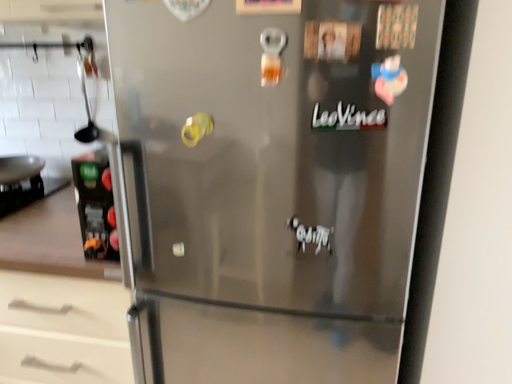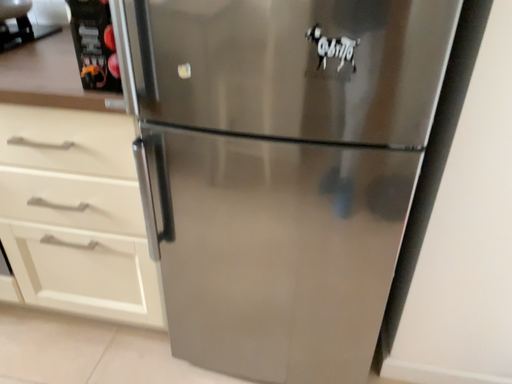
Question: How did the camera likely rotate when shooting the video?

Choices:
 (A) rotated downward
 (B) rotated upward

Answer: (A)